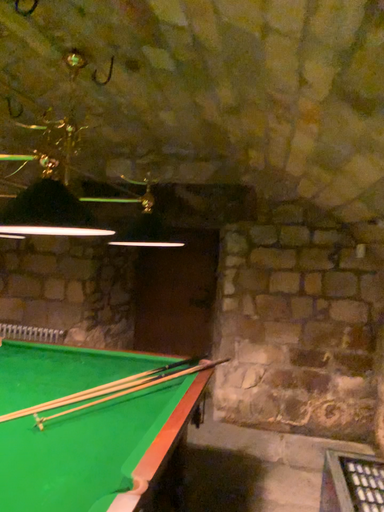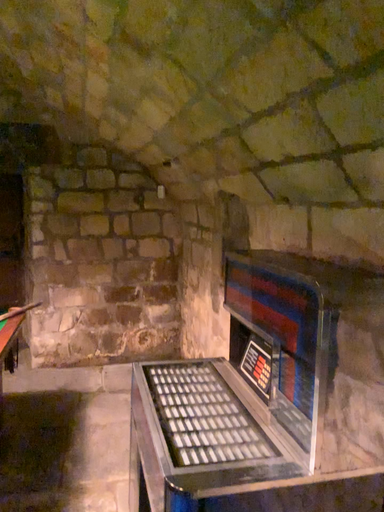
Question: How did the camera likely rotate when shooting the video?

Choices:
 (A) rotated downward
 (B) rotated upward

Answer: (A)